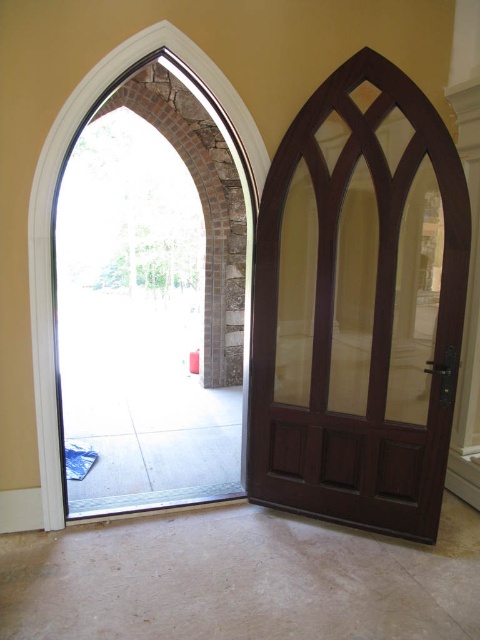
Question: Which point appears closest to the camera in this image?

Choices:
 (A) (384, 481)
 (B) (160, 120)

Answer: (A)

Question: Can you confirm if clear glass door at center is positioned to the right of mahogany wood door at right?

Choices:
 (A) yes
 (B) no

Answer: (B)

Question: Can you confirm if clear glass door at center is smaller than mahogany wood door at right?

Choices:
 (A) yes
 (B) no

Answer: (A)

Question: Among these points, which one is farthest from the camera?

Choices:
 (A) pos(124,273)
 (B) pos(348,160)

Answer: (A)

Question: Is clear glass door at center bigger than mahogany wood door at right?

Choices:
 (A) no
 (B) yes

Answer: (A)